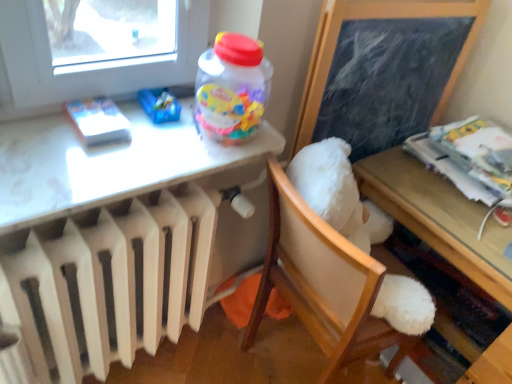
Identify the location of free spot to the right of white matte book at upper left, placed as the 2th magazine when sorted from right to left. This screenshot has width=512, height=384. coord(166,149).